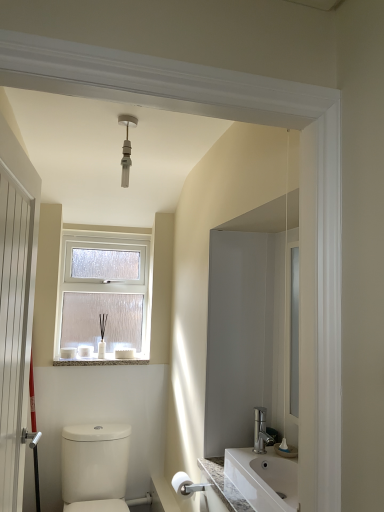
Image resolution: width=384 pixels, height=512 pixels. What do you see at coordinates (180, 481) in the screenshot?
I see `white matte toilet paper at lower center` at bounding box center [180, 481].

What do you see at coordinates (95, 467) in the screenshot? I see `white glossy toilet at lower left` at bounding box center [95, 467].

What do you see at coordinates (126, 148) in the screenshot? I see `white plastic light fixture at upper center` at bounding box center [126, 148].

What do you see at coordinates (104, 359) in the screenshot? I see `white marble window sill at lower center` at bounding box center [104, 359].

The width and height of the screenshot is (384, 512). Find the location of `white matte toilet paper at lower center`. white matte toilet paper at lower center is located at coordinates (180, 481).

Would you consider white matte toilet paper at lower center to be distant from white wooden door at left?

Yes, white matte toilet paper at lower center and white wooden door at left are quite far apart.

Which of these two, white matte toilet paper at lower center or white wooden door at left, stands taller?

Standing taller between the two is white wooden door at left.

Which is more to the left, white matte toilet paper at lower center or white wooden door at left?

Positioned to the left is white wooden door at left.

From a real-world perspective, is white matte toilet paper at lower center below white wooden door at left?

Correct, in the physical world, white matte toilet paper at lower center is lower than white wooden door at left.

Where is `toilet located in front of the white frosted glass window at upper center`? The image size is (384, 512). toilet located in front of the white frosted glass window at upper center is located at coordinates (95, 467).

In the image, is white frosted glass window at upper center positioned in front of or behind white glossy toilet at lower left?

In the image, white frosted glass window at upper center appears behind white glossy toilet at lower left.

Which of these two, white frosted glass window at upper center or white glossy toilet at lower left, stands taller?

white frosted glass window at upper center is taller.

Is point (91, 344) closer to viewer compared to point (94, 469)?

That is False.

Is white matte toilet paper at lower center looking in the opposite direction of white glossy toilet at lower left?

That's not correct — white matte toilet paper at lower center is not looking away from white glossy toilet at lower left.

Is white glossy toilet at lower left completely or partially inside white matte toilet paper at lower center?

No, white glossy toilet at lower left is not inside white matte toilet paper at lower center.

Would you say white matte toilet paper at lower center is to the left or to the right of white glossy toilet at lower left in the picture?

From the image, it's evident that white matte toilet paper at lower center is to the right of white glossy toilet at lower left.

From a real-world perspective, is white matte toilet paper at lower center positioned above or below white glossy toilet at lower left?

white matte toilet paper at lower center is above white glossy toilet at lower left.

From the image's perspective, between white matte toilet paper at lower center and white frosted glass window at upper center, which one is located above?

white frosted glass window at upper center, from the image's perspective.

Could white frosted glass window at upper center be considered to be inside white matte toilet paper at lower center?

That's incorrect, white frosted glass window at upper center is not inside white matte toilet paper at lower center.

Considering the positions of points (174, 484) and (75, 257), is point (174, 484) closer to camera compared to point (75, 257)?

Yes, it is.

At what (x,y) coordinates should I click in order to perform the action: click on toilet paper directly beneath the white frosted glass window at upper center (from a real-world perspective). Please return your answer as a coordinate pair (x, y). Looking at the image, I should click on (180, 481).

Is there a large distance between white wooden door at left and white plastic light fixture at upper center?

No, white wooden door at left is not far from white plastic light fixture at upper center.

Considering the positions of points (31, 282) and (124, 114), is point (31, 282) closer to camera compared to point (124, 114)?

Yes, it is in front of point (124, 114).

How many degrees apart are the facing directions of white wooden door at left and white plastic light fixture at upper center?

The angular difference between white wooden door at left and white plastic light fixture at upper center is 88.6 degrees.

Is white matte toilet paper at lower center in front of or behind white glossy toiletries at window in the image?

In the image, white matte toilet paper at lower center appears in front of white glossy toiletries at window.

Looking at this image, from the image's perspective, which one is positioned lower, white matte toilet paper at lower center or white glossy toiletries at window?

white matte toilet paper at lower center is shown below in the image.

Between white matte toilet paper at lower center and white glossy toiletries at window, which one has smaller width?

With smaller width is white matte toilet paper at lower center.

Are white glossy toilet at lower left and white plastic light fixture at upper center making contact?

white glossy toilet at lower left is not next to white plastic light fixture at upper center, and they're not touching.

Measure the distance between white glossy toilet at lower left and white plastic light fixture at upper center.

white glossy toilet at lower left and white plastic light fixture at upper center are 5.22 feet apart.

This screenshot has height=512, width=384. Find the location of `light fixture in front of the white glossy toilet at lower left`. light fixture in front of the white glossy toilet at lower left is located at coordinates (126, 148).

Is white plastic light fixture at upper center inside white glossy toilet at lower left?

Actually, white plastic light fixture at upper center is outside white glossy toilet at lower left.

This screenshot has width=384, height=512. Find the location of `door above the white matte toilet paper at lower center (from the image's perspective)`. door above the white matte toilet paper at lower center (from the image's perspective) is located at coordinates (14, 325).

Locate an element on the screen. window above the white glossy toilet at lower left (from a real-world perspective) is located at coordinates (104, 294).

In the scene shown: Considering their positions, is white marble window sill at lower center positioned closer to white glossy toilet at lower left than white glossy toiletries at window?

white marble window sill at lower center is closer to white glossy toilet at lower left.

In the scene shown: Considering their positions, is white frosted glass window at upper center positioned further to white plastic light fixture at upper center than white matte toilet paper at lower center?

white matte toilet paper at lower center is positioned further to the anchor white plastic light fixture at upper center.

From the image, which object appears to be farther from white wooden door at left, white glossy toiletries at window or white frosted glass window at upper center?

white glossy toiletries at window lies further to white wooden door at left than the other object.

Looking at the image, which one is located closer to white wooden door at left, white frosted glass window at upper center or white glossy toiletries at window?

white frosted glass window at upper center.

Considering their positions, is white frosted glass window at upper center positioned closer to white plastic light fixture at upper center than white glossy toiletries at window?

Among the two, white frosted glass window at upper center is located nearer to white plastic light fixture at upper center.

When comparing their distances from white glossy toiletries at window, does white frosted glass window at upper center or white plastic light fixture at upper center seem further?

The object further to white glossy toiletries at window is white plastic light fixture at upper center.

Considering their positions, is white plastic light fixture at upper center positioned closer to white wooden door at left than white matte toilet paper at lower center?

white plastic light fixture at upper center.

Which object lies nearer to the anchor point white marble window sill at lower center, white frosted glass window at upper center or white glossy toiletries at window?

white glossy toiletries at window.

Identify the location of toiletry that lies between white frosted glass window at upper center and white glossy toilet at lower left from top to bottom. (85, 350).

What are the coordinates of `window sill that lies between white plastic light fixture at upper center and white matte toilet paper at lower center from top to bottom` in the screenshot? It's located at (x=104, y=359).

Locate an element on the screen. The image size is (384, 512). window sill located between white matte toilet paper at lower center and white frosted glass window at upper center in the depth direction is located at coordinates point(104,359).

At what (x,y) coordinates should I click in order to perform the action: click on light fixture between white wooden door at left and white glossy toiletries at window along the z-axis. Please return your answer as a coordinate pair (x, y). The height and width of the screenshot is (512, 384). Looking at the image, I should click on (126, 148).